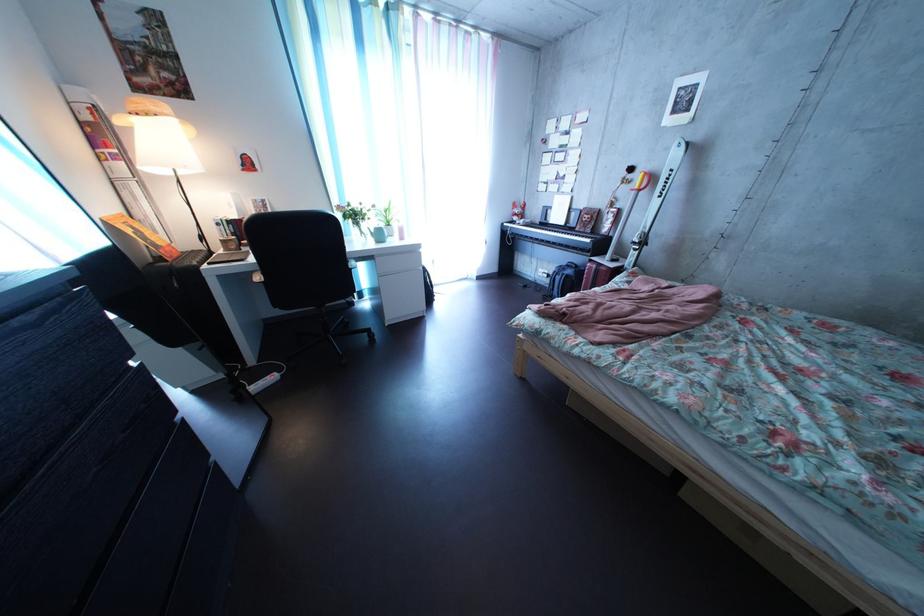
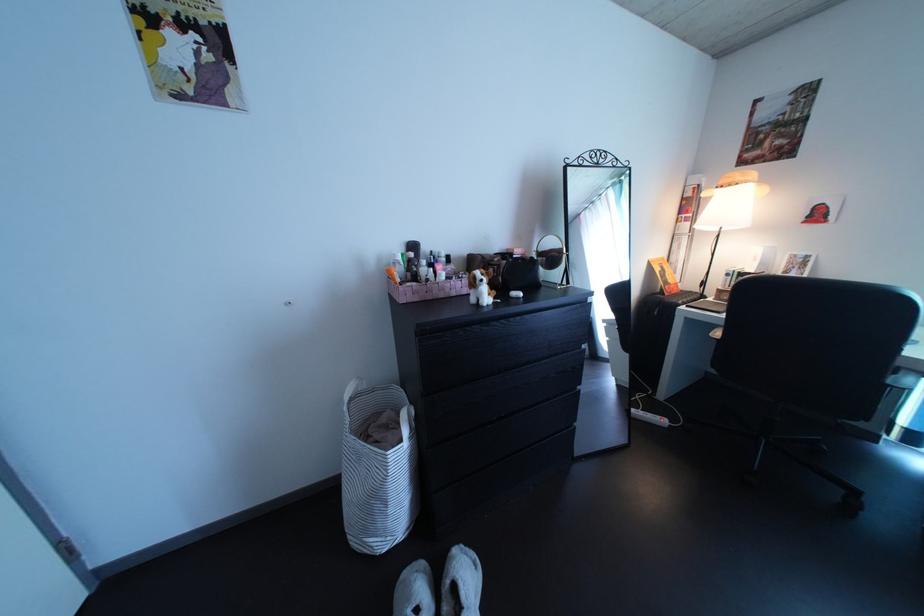
The point at (131,130) is marked in the first image. Where is the corresponding point in the second image?

(719, 203)